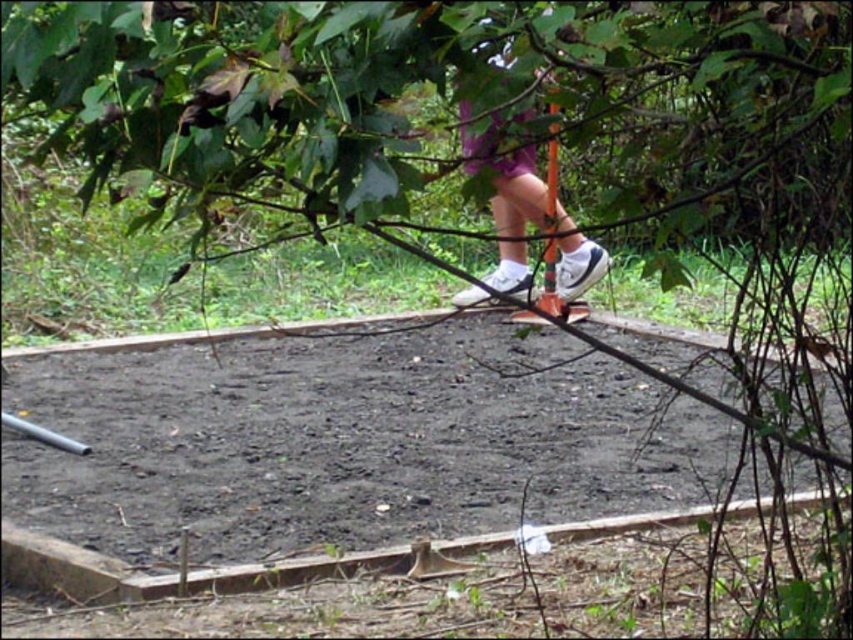
Which is behind, point (306, 372) or point (531, 156)?

The point (531, 156) is behind.

Is point (259, 428) behind point (544, 227)?

Yes, point (259, 428) is farther from viewer.

Is point (653, 362) positioned in front of point (505, 285)?

That is True.

Where is `dark brown soil at center`? dark brown soil at center is located at coordinates (340, 440).